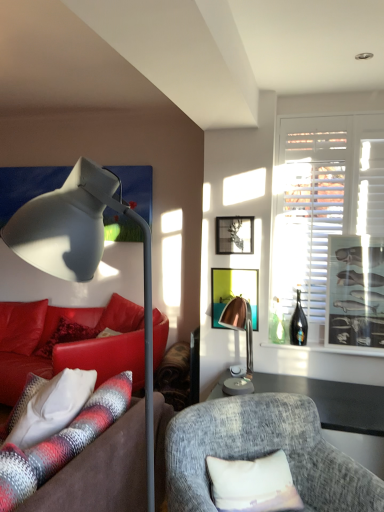
Question: Does white textured pillow at lower left, which appears as the first pillow when viewed from the left, have a lesser width compared to copper metallic lamp at center, positioned as the 2th lamp in front-to-back order?

Choices:
 (A) yes
 (B) no

Answer: (B)

Question: Can you confirm if white textured pillow at lower left, the 2th pillow from the right, is bigger than copper metallic lamp at center, which is counted as the first lamp, starting from the right?

Choices:
 (A) yes
 (B) no

Answer: (A)

Question: From the image's perspective, is white textured pillow at lower left, positioned as the 2th pillow in front-to-back order, over copper metallic lamp at center, positioned as the 2th lamp in front-to-back order?

Choices:
 (A) yes
 (B) no

Answer: (B)

Question: Does white textured pillow at lower left, arranged as the first pillow when viewed from the back, lie in front of copper metallic lamp at center, which is counted as the 1th lamp, starting from the back?

Choices:
 (A) yes
 (B) no

Answer: (A)

Question: Is white textured pillow at lower left, positioned as the 2th pillow in front-to-back order, smaller than copper metallic lamp at center, which is counted as the first lamp, starting from the right?

Choices:
 (A) yes
 (B) no

Answer: (B)

Question: Is copper metallic lamp at center, which is counted as the 1th lamp, starting from the back, inside white textured pillow at lower left, which appears as the first pillow when viewed from the left?

Choices:
 (A) yes
 (B) no

Answer: (B)

Question: From a real-world perspective, is metallic silver picture frame at right, which is the first picture frame in right-to-left order, beneath black glass bottle at right?

Choices:
 (A) yes
 (B) no

Answer: (B)

Question: Is metallic silver picture frame at right, which is the 3th picture frame in left-to-right order, at the left side of black glass bottle at right?

Choices:
 (A) yes
 (B) no

Answer: (B)

Question: Is metallic silver picture frame at right, which is the 3th picture frame in left-to-right order, looking in the opposite direction of black glass bottle at right?

Choices:
 (A) yes
 (B) no

Answer: (B)

Question: From the image's perspective, is metallic silver picture frame at right, which is the first picture frame in right-to-left order, below black glass bottle at right?

Choices:
 (A) no
 (B) yes

Answer: (A)

Question: Considering the relative positions of metallic silver picture frame at right, which is the first picture frame in right-to-left order, and black glass bottle at right in the image provided, is metallic silver picture frame at right, which is the first picture frame in right-to-left order, behind black glass bottle at right?

Choices:
 (A) no
 (B) yes

Answer: (A)

Question: Is black glass bottle at right located within metallic silver picture frame at right, which is the 3th picture frame in left-to-right order?

Choices:
 (A) yes
 (B) no

Answer: (B)

Question: Considering the relative sizes of clear glass bottle at right and copper metallic lamp at center, which is counted as the first lamp, starting from the right, in the image provided, is clear glass bottle at right smaller than copper metallic lamp at center, which is counted as the first lamp, starting from the right,?

Choices:
 (A) yes
 (B) no

Answer: (A)